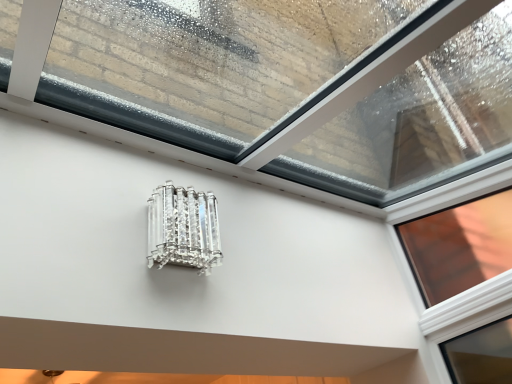
What do you see at coordinates (183, 228) in the screenshot? The width and height of the screenshot is (512, 384). I see `clear crystal light fixture at center` at bounding box center [183, 228].

Locate an element on the screen. The image size is (512, 384). clear crystal light fixture at center is located at coordinates click(183, 228).

Find the location of a particular element. clear crystal light fixture at center is located at coordinates (183, 228).